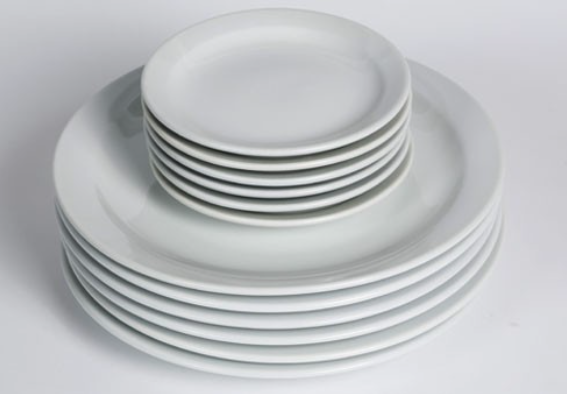
I want to click on large plates, so point(273,295), point(273,308), point(275,325), point(275,337), point(276,364), point(234,375).